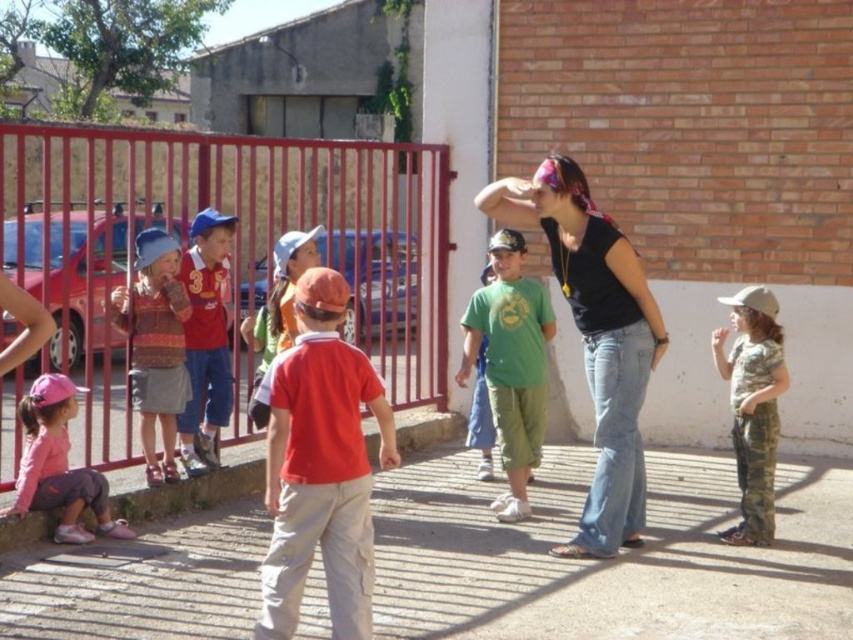
Question: Can you confirm if red metal fence at left is positioned to the left of matte red shirt at center?

Choices:
 (A) no
 (B) yes

Answer: (B)

Question: Is matte red shirt at center to the right of pink fabric cap at lower left from the viewer's perspective?

Choices:
 (A) yes
 (B) no

Answer: (A)

Question: Can you confirm if black tank top at center is positioned to the right of green cotton shirt at center?

Choices:
 (A) no
 (B) yes

Answer: (B)

Question: Which point is closer to the camera taking this photo?

Choices:
 (A) pyautogui.click(x=86, y=285)
 (B) pyautogui.click(x=125, y=304)
 (C) pyautogui.click(x=201, y=346)
 (D) pyautogui.click(x=751, y=445)

Answer: (D)

Question: Estimate the real-world distances between objects in this image. Which object is farther from the red metal fence at left?

Choices:
 (A) black tank top at center
 (B) matte red shirt at center
 (C) green cotton shirt at center

Answer: (A)

Question: Which object is positioned farthest from the red cotton shirt at center?

Choices:
 (A) black tank top at center
 (B) pink fabric cap at lower left
 (C) striped sweater at left
 (D) matte red shirt at center

Answer: (D)